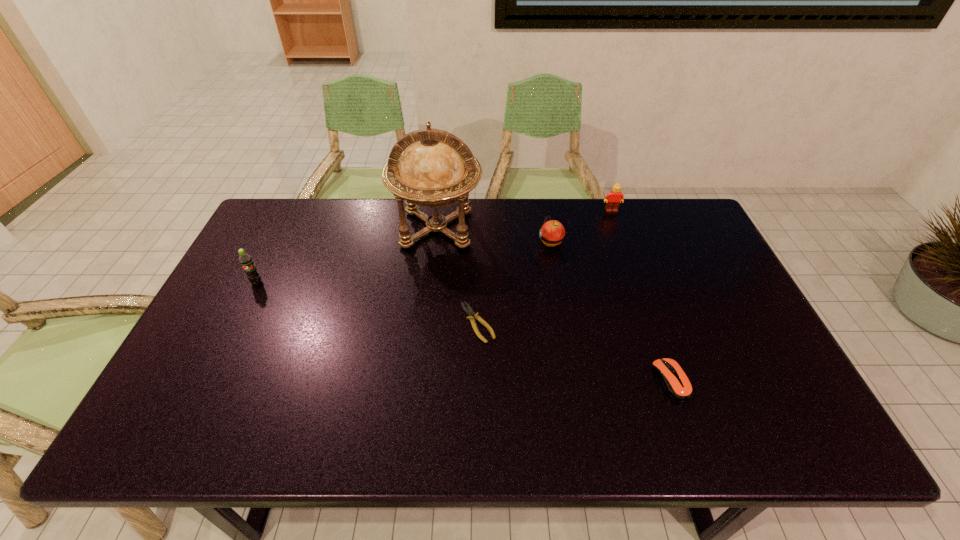
Identify the location of empty space that is in between the fourth object from left to right and the tallest object. (494, 235).

I want to click on vacant area that lies between the third nearest object and the fourth shortest object, so click(434, 247).

Find the location of a particular element. Image resolution: width=960 pixels, height=540 pixels. vacant space in between the fourth object from left to right and the globe is located at coordinates pos(494,235).

Where is `empty space that is in between the Lego and the shortest object`? empty space that is in between the Lego and the shortest object is located at coordinates (544, 267).

You are a GUI agent. You are given a task and a screenshot of the screen. Output one action in this format:
    pyautogui.click(x=<x>, y=<y>)
    Task: Click on the free space between the soda and the computer mouse
    This screenshot has width=960, height=540.
    Given the screenshot: What is the action you would take?
    pyautogui.click(x=464, y=332)

In order to click on vacant area between the fourth shortest object and the tallest object in this screenshot , I will do `click(524, 219)`.

Identify which object is the closest to the leftmost object. Please provide its 2D coordinates. Your answer should be formatted as a tuple, i.e. [(x, y)], where the tuple contains the x and y coordinates of a point satisfying the conditions above.

[(437, 169)]

Identify which object is the closest to the third tallest object. Please provide its 2D coordinates. Your answer should be formatted as a tuple, i.e. [(x, y)], where the tuple contains the x and y coordinates of a point satisfying the conditions above.

[(552, 233)]

At what (x,y) coordinates should I click in order to perform the action: click on vacant point that satisfies the following two spatial constraints: 1. on the front side of the apple; 2. on the right side of the computer mouse. Please return your answer as a coordinate pair (x, y). Looking at the image, I should click on (575, 381).

Where is `free location that satisfies the following two spatial constraints: 1. on the front label of the leftmost object; 2. on the left side of the pliers`? Image resolution: width=960 pixels, height=540 pixels. free location that satisfies the following two spatial constraints: 1. on the front label of the leftmost object; 2. on the left side of the pliers is located at coordinates (236, 323).